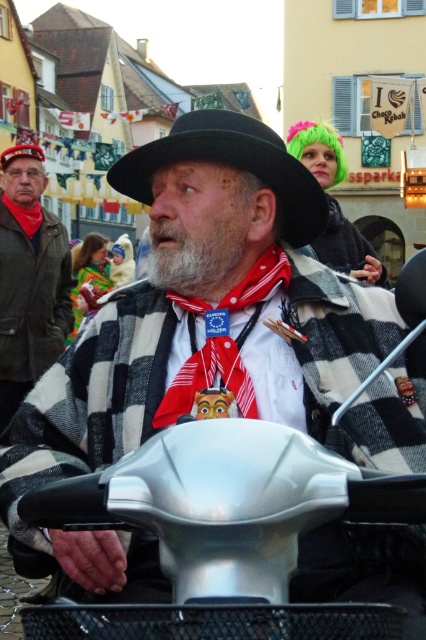
You are a photographer standing at the edge of the street trying to capture both the matte black jacket at left and the black felt hat at center in a single shot. Given that your camera has a maximum focal length that allows capturing objects up to 10 meters apart in the same frame, will you be able to include both objects in your photo?

The matte black jacket at left and the black felt hat at center are 11.89 meters apart from each other. Since the maximum distance your camera can capture in one frame is 10 meters, you won

You are a photographer standing at the edge of the street. You want to take a photo of the black felt hat at center and the graywoollybeard at center so that both are clearly visible in the frame. Given that your camera has a maximum focus range of 4 meters, will you be able to capture both objects in focus without moving closer?

The black felt hat at center and graywoollybeard at center are 4.16 meters apart. Since the distance between them exceeds the camera maximum focus range of 4 meters, you cannot capture both in focus without moving closer.

Based on the scene description, which object is located lower in the image, the matte black jacket at left or the black felt hat at center?

The matte black jacket at left is positioned under the black felt hat at center, so the matte black jacket at left is lower in the image.